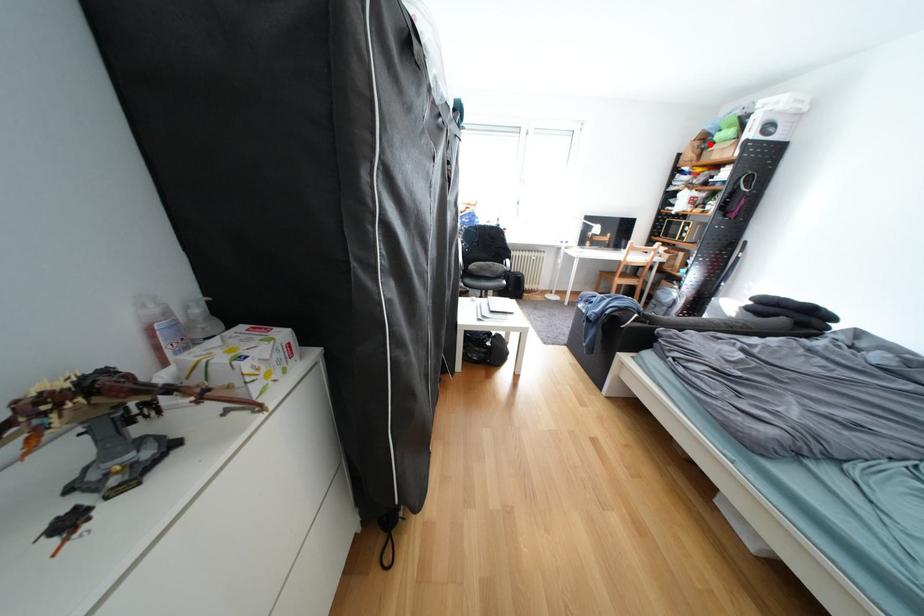
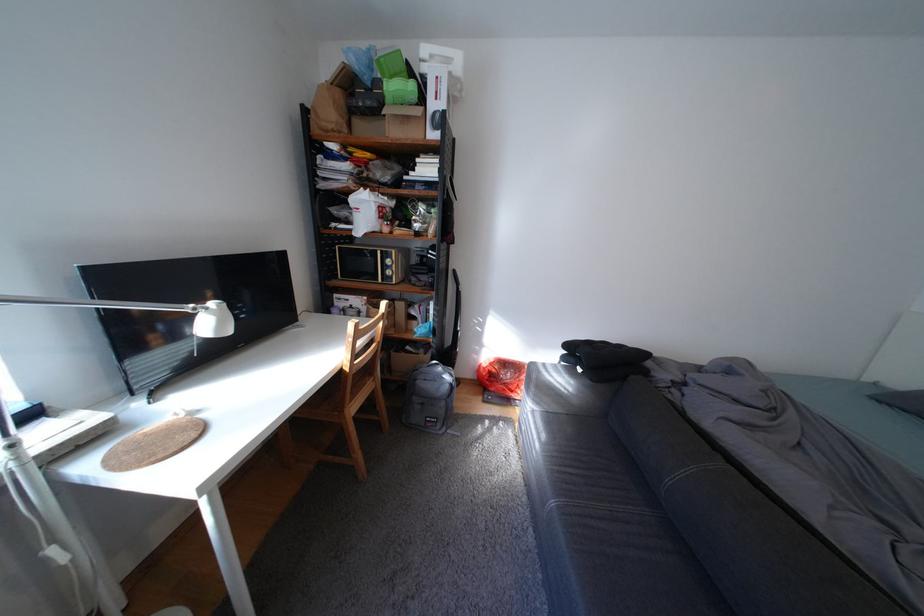
Locate, in the second image, the point that corresponds to the highlighted location in the first image.

(351, 95)